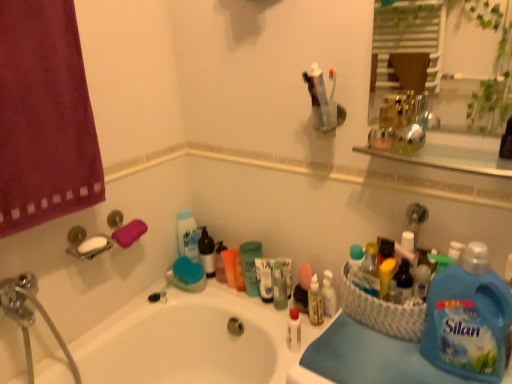
Question: From the image's perspective, is white glossy bottle at center, marked as the second toiletry in a back-to-front arrangement, located above or below translucent plastic cup at center, the 2th cleaning product from the right?

Choices:
 (A) below
 (B) above

Answer: (A)

Question: Is white glossy bottle at center, the second toiletry from the right, bigger or smaller than translucent plastic cup at center, marked as the first cleaning product in a left-to-right arrangement?

Choices:
 (A) small
 (B) big

Answer: (A)

Question: Which object is positioned farthest from the white glossy bottle at center, the second toiletry from the right?

Choices:
 (A) translucent plastic cup at center, arranged as the 1th cleaning product when viewed from the back
 (B) translucent plastic bottle at center, which is the 1th toiletry from back to front
 (C) blue fabric at lower right
 (D) purple cotton towel at left
 (E) white glossy bathtub at center

Answer: (D)

Question: Which of these objects is positioned closest to the white glossy bathtub at center?

Choices:
 (A) blue fabric at lower right
 (B) blue liquid detergent at lower right, the 1th cleaning product viewed from the front
 (C) purple cotton towel at left
 (D) translucent plastic bottle at center, which is counted as the first toiletry, starting from the right
 (E) translucent plastic cup at center, arranged as the 1th cleaning product when viewed from the back

Answer: (E)